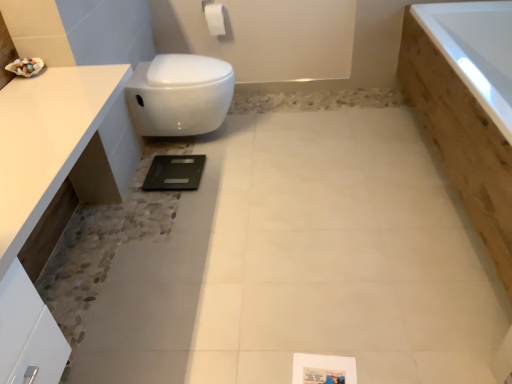
Question: Should I look upward or downward to see wooden bathtub at right?

Choices:
 (A) down
 (B) up

Answer: (B)

Question: Is white glossy countertop at upper left aimed at white matte toilet paper at upper center?

Choices:
 (A) yes
 (B) no

Answer: (B)

Question: Can you confirm if white glossy countertop at upper left is bigger than white matte toilet paper at upper center?

Choices:
 (A) no
 (B) yes

Answer: (B)

Question: Considering the relative positions of white glossy countertop at upper left and white matte toilet paper at upper center in the image provided, is white glossy countertop at upper left in front of white matte toilet paper at upper center?

Choices:
 (A) yes
 (B) no

Answer: (A)

Question: From the image's perspective, is white glossy countertop at upper left below white matte toilet paper at upper center?

Choices:
 (A) no
 (B) yes

Answer: (B)

Question: From the image's perspective, is white glossy countertop at upper left above white matte toilet paper at upper center?

Choices:
 (A) yes
 (B) no

Answer: (B)

Question: Is white glossy countertop at upper left positioned with its back to white matte toilet paper at upper center?

Choices:
 (A) yes
 (B) no

Answer: (B)

Question: Is wooden bathtub at right with white glossy countertop at upper left?

Choices:
 (A) yes
 (B) no

Answer: (B)

Question: Is wooden bathtub at right completely or partially outside of white glossy countertop at upper left?

Choices:
 (A) no
 (B) yes

Answer: (B)

Question: From a real-world perspective, is wooden bathtub at right on top of white glossy countertop at upper left?

Choices:
 (A) no
 (B) yes

Answer: (A)

Question: Can you confirm if wooden bathtub at right is wider than white glossy countertop at upper left?

Choices:
 (A) yes
 (B) no

Answer: (A)

Question: Is white glossy countertop at upper left surrounded by wooden bathtub at right?

Choices:
 (A) no
 (B) yes

Answer: (A)

Question: From the image's perspective, is wooden bathtub at right beneath white glossy countertop at upper left?

Choices:
 (A) yes
 (B) no

Answer: (B)

Question: From a real-world perspective, is white matte toilet paper at upper center below white glossy countertop at upper left?

Choices:
 (A) no
 (B) yes

Answer: (A)